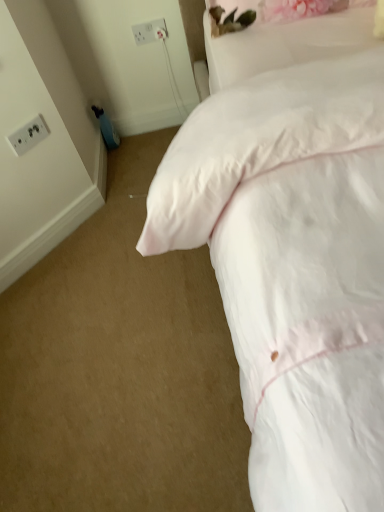
Question: Is white plastic electrical outlet at upper left, placed as the first electric outlet when sorted from front to back, in contact with white satin pillow at upper right?

Choices:
 (A) yes
 (B) no

Answer: (B)

Question: From the image's perspective, is white plastic electrical outlet at upper left, the 2th electric outlet in the back-to-front sequence, on white satin pillow at upper right?

Choices:
 (A) no
 (B) yes

Answer: (A)

Question: Is there a large distance between white plastic electrical outlet at upper left, placed as the 2th electric outlet when sorted from right to left, and white satin pillow at upper right?

Choices:
 (A) yes
 (B) no

Answer: (B)

Question: Does white plastic electrical outlet at upper left, which is the second electric outlet in top-to-bottom order, have a lesser height compared to white satin pillow at upper right?

Choices:
 (A) yes
 (B) no

Answer: (A)

Question: Is white plastic electrical outlet at upper left, placed as the 2th electric outlet when sorted from right to left, looking in the opposite direction of white satin pillow at upper right?

Choices:
 (A) no
 (B) yes

Answer: (A)

Question: From the image's perspective, relative to white plastic socket at upper left, the 2th electric outlet when ordered from bottom to top, is white satin pillow at upper right above or below?

Choices:
 (A) below
 (B) above

Answer: (A)

Question: From a real-world perspective, is white satin pillow at upper right positioned above or below white plastic socket at upper left, the first electric outlet positioned from the right?

Choices:
 (A) above
 (B) below

Answer: (A)

Question: Does point (332, 33) appear closer or farther from the camera than point (137, 44)?

Choices:
 (A) farther
 (B) closer

Answer: (B)

Question: In terms of width, does white satin pillow at upper right look wider or thinner when compared to white plastic socket at upper left, the first electric outlet positioned from the right?

Choices:
 (A) thin
 (B) wide

Answer: (B)

Question: From the image's perspective, is white plastic socket at upper left, arranged as the 2th electric outlet when viewed from the front, located above or below white plastic electrical outlet at upper left, which is the second electric outlet in top-to-bottom order?

Choices:
 (A) below
 (B) above

Answer: (B)

Question: Would you say white plastic socket at upper left, placed as the first electric outlet when sorted from back to front, is inside or outside white plastic electrical outlet at upper left, which is the second electric outlet in top-to-bottom order?

Choices:
 (A) inside
 (B) outside

Answer: (B)

Question: From a real-world perspective, is white plastic socket at upper left, positioned as the first electric outlet in top-to-bottom order, positioned above or below white plastic electrical outlet at upper left, arranged as the first electric outlet when viewed from the left?

Choices:
 (A) below
 (B) above

Answer: (B)

Question: Considering their positions, is white plastic socket at upper left, the first electric outlet positioned from the right, located in front of or behind white plastic electrical outlet at upper left, placed as the 2th electric outlet when sorted from right to left?

Choices:
 (A) front
 (B) behind

Answer: (B)

Question: Is white plastic socket at upper left, placed as the first electric outlet when sorted from back to front, inside or outside of white soft bed at upper right?

Choices:
 (A) inside
 (B) outside

Answer: (B)

Question: From the image's perspective, is white plastic socket at upper left, the first electric outlet positioned from the right, located above or below white soft bed at upper right?

Choices:
 (A) above
 (B) below

Answer: (A)